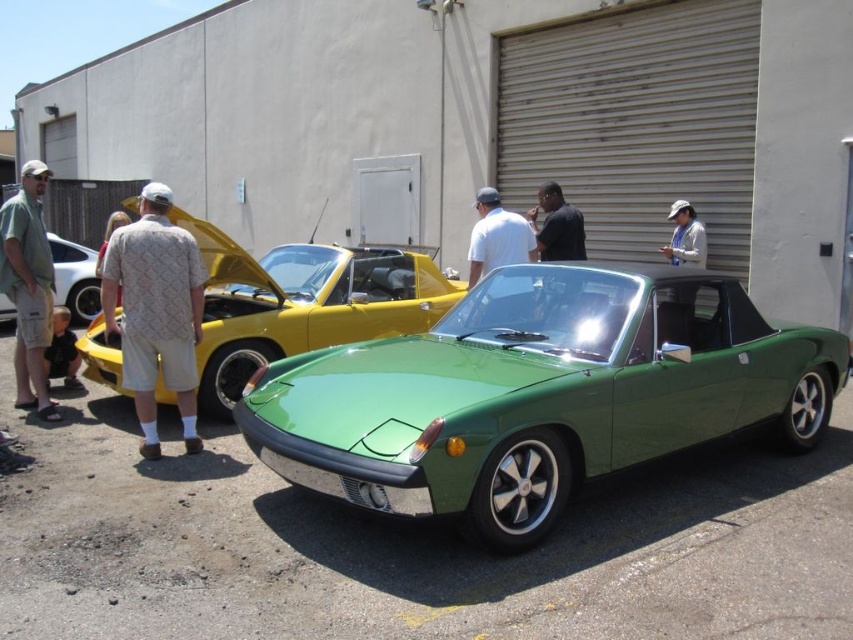
Based on the photo, can you confirm if green metallic car at center is taller than green fabric shirt at left?

No, green metallic car at center is not taller than green fabric shirt at left.

Locate an element on the screen. green metallic car at center is located at coordinates (537, 394).

Between green metallic car at center and white cotton shirt at center, which one appears on the right side from the viewer's perspective?

green metallic car at center

Does green metallic car at center appear on the left side of white cotton shirt at center?

Incorrect, green metallic car at center is not on the left side of white cotton shirt at center.

Is point (699, 340) positioned in front of point (521, 243)?

Yes, it is.

I want to click on green metallic car at center, so click(537, 394).

Can you confirm if green matte sports car at center is wider than khaki patterned shirt at center?

Yes, green matte sports car at center is wider than khaki patterned shirt at center.

Is green matte sports car at center thinner than khaki patterned shirt at center?

No.

The image size is (853, 640). Find the location of `green matte sports car at center`. green matte sports car at center is located at coordinates point(303,301).

You are a GUI agent. You are given a task and a screenshot of the screen. Output one action in this format:
    pyautogui.click(x=<x>, y=<y>)
    Task: Click on the green matte sports car at center
    This screenshot has height=640, width=853.
    Given the screenshot: What is the action you would take?
    pyautogui.click(x=303, y=301)